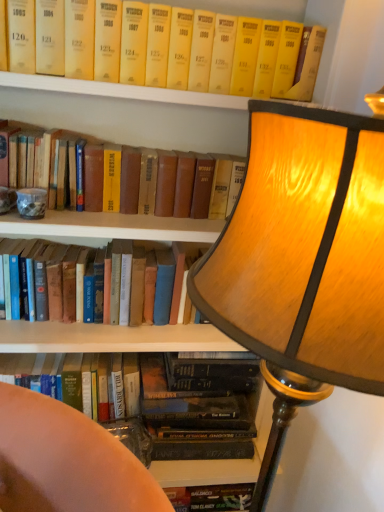
Question: Is hardcover book at left, which is the third book in top-to-bottom order, bigger than wooden lampshade at upper right?

Choices:
 (A) no
 (B) yes

Answer: (A)

Question: Is hardcover book at left, arranged as the second book when ordered from the bottom, positioned with its back to wooden lampshade at upper right?

Choices:
 (A) yes
 (B) no

Answer: (B)

Question: Is hardcover book at left, which is the third book in top-to-bottom order, smaller than wooden lampshade at upper right?

Choices:
 (A) yes
 (B) no

Answer: (A)

Question: Is hardcover book at left, which is the third book in top-to-bottom order, in contact with wooden lampshade at upper right?

Choices:
 (A) no
 (B) yes

Answer: (A)

Question: Considering the relative sizes of hardcover book at left, arranged as the second book when ordered from the bottom, and wooden lampshade at upper right in the image provided, is hardcover book at left, arranged as the second book when ordered from the bottom, shorter than wooden lampshade at upper right?

Choices:
 (A) yes
 (B) no

Answer: (A)

Question: From the image's perspective, is hardcover book at left, which is the third book in top-to-bottom order, on top of wooden lampshade at upper right?

Choices:
 (A) yes
 (B) no

Answer: (A)

Question: From a real-world perspective, is yellow paperback book at upper center, the 1th book when ordered from top to bottom, physically below wooden lampshade at upper right?

Choices:
 (A) no
 (B) yes

Answer: (A)

Question: Does yellow paperback book at upper center, which appears as the 4th book when ordered from the bottom, have a lesser height compared to wooden lampshade at upper right?

Choices:
 (A) no
 (B) yes

Answer: (B)

Question: Is the surface of yellow paperback book at upper center, which appears as the 4th book when ordered from the bottom, in direct contact with wooden lampshade at upper right?

Choices:
 (A) yes
 (B) no

Answer: (B)

Question: Is yellow paperback book at upper center, the 1th book when ordered from top to bottom, at the right side of wooden lampshade at upper right?

Choices:
 (A) no
 (B) yes

Answer: (A)

Question: From the image's perspective, does yellow paperback book at upper center, which appears as the 4th book when ordered from the bottom, appear higher than wooden lampshade at upper right?

Choices:
 (A) yes
 (B) no

Answer: (A)

Question: Is yellow paperback book at upper center, which appears as the 4th book when ordered from the bottom, closer to the viewer compared to wooden lampshade at upper right?

Choices:
 (A) no
 (B) yes

Answer: (A)

Question: Is yellow paperback book at upper center, which appears as the 4th book when ordered from the bottom, further to camera compared to yellow hardcover book at upper center, which appears as the 3th book when ordered from the bottom?

Choices:
 (A) no
 (B) yes

Answer: (A)